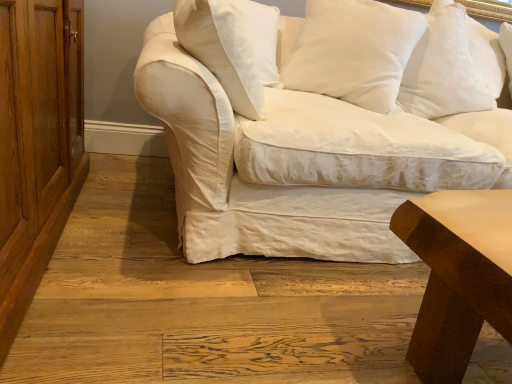
Question: Relative to smooth brown wood table at lower right, is white cotton pillow at upper right, which appears as the first pillow when viewed from the right, in front or behind?

Choices:
 (A) front
 (B) behind

Answer: (B)

Question: Is point (492, 91) closer or farther from the camera than point (440, 289)?

Choices:
 (A) farther
 (B) closer

Answer: (A)

Question: Which is nearer to the white cotton couch at center?

Choices:
 (A) wooden dresser at left
 (B) white cotton pillow at upper right, which is the second pillow from right to left
 (C) white cotton pillow at upper right, which appears as the first pillow when viewed from the right
 (D) white cotton pillow at upper center, placed as the second pillow when sorted from left to right
 (E) white cotton pillow at upper center, marked as the first pillow in a left-to-right arrangement

Answer: (D)

Question: Which object is the closest to the white cotton couch at center?

Choices:
 (A) white cotton pillow at upper center, placed as the 3th pillow when sorted from right to left
 (B) white cotton pillow at upper right, which is the second pillow from right to left
 (C) wooden dresser at left
 (D) white cotton pillow at upper right, which appears as the first pillow when viewed from the right
 (E) white cotton pillow at upper center, marked as the first pillow in a left-to-right arrangement

Answer: (A)